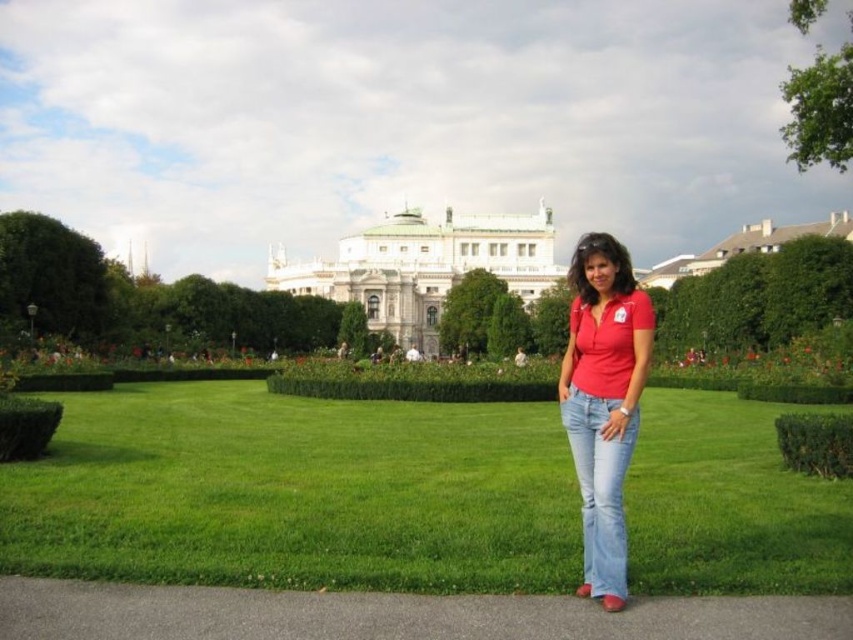
You are a landscape architect designing a new pathway between the white stone building at center and the green leafy hedge at upper right. The pathway must be straight and 2 meters wide. Can you estimate if there is enough space between them to accommodate this pathway without any obstruction?

The distance between the white stone building at center and the green leafy hedge at upper right is 42.29 meters. Since the pathway only requires 2 meters of width, there is ample space to accommodate it without any obstruction.

You are a photographer trying to capture a photo of the woman in the park. You want to ensure that both the matte red shirt at center and the green grass at center are clearly visible in your shot. Based on their sizes, which object should you focus on to ensure both are in frame?

The green grass at center might be wider than the matte red shirt at center, so focusing on the larger green grass at center would help ensure both are in frame.